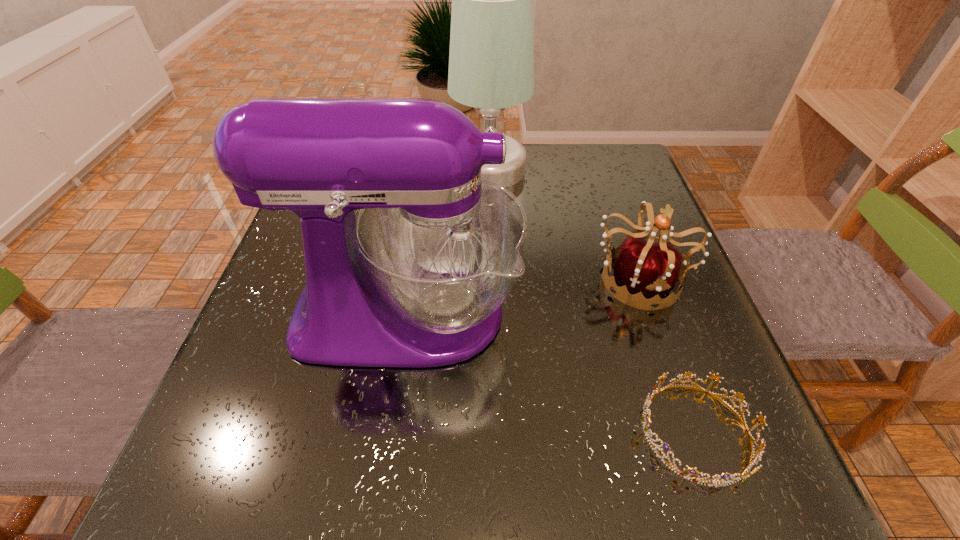
Locate an element on the screen. This screenshot has width=960, height=540. free space at the right edge is located at coordinates click(x=602, y=210).

Find the location of `vacant area that lies between the third tallest object and the farthest object`. vacant area that lies between the third tallest object and the farthest object is located at coordinates (564, 224).

Find the location of a particular element. This screenshot has width=960, height=540. vacant space in between the farther tiara and the shorter tiara is located at coordinates (667, 355).

Locate an element on the screen. free space between the nearer tiara and the mixer is located at coordinates (551, 373).

Where is `vacant area between the mixer and the shortest object`? This screenshot has width=960, height=540. vacant area between the mixer and the shortest object is located at coordinates (551, 373).

The height and width of the screenshot is (540, 960). Identify the location of vacant space that's between the nearer tiara and the mixer. (551, 373).

The image size is (960, 540). I want to click on free space between the taller tiara and the lampshade, so pos(564,224).

The height and width of the screenshot is (540, 960). Find the location of `free space between the taller tiara and the shortest object`. free space between the taller tiara and the shortest object is located at coordinates coord(667,355).

Locate an element on the screen. This screenshot has width=960, height=540. free space between the nearer tiara and the mixer is located at coordinates (551, 373).

At what (x,y) coordinates should I click in order to perform the action: click on object that is the third closest to the shorter tiara. Please return your answer as a coordinate pair (x, y). Looking at the image, I should click on pyautogui.click(x=491, y=62).